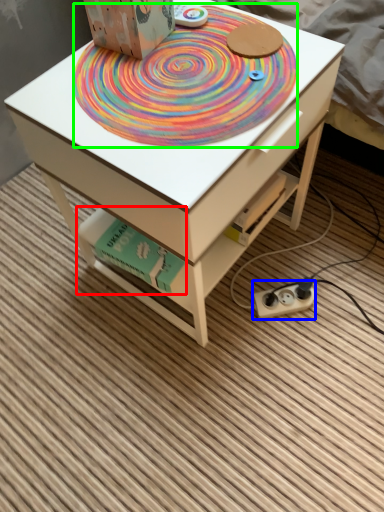
Question: Which is nearer to the book (highlighted by a red box)? plug (highlighted by a blue box) or mat (highlighted by a green box).

Choices:
 (A) plug
 (B) mat

Answer: (B)